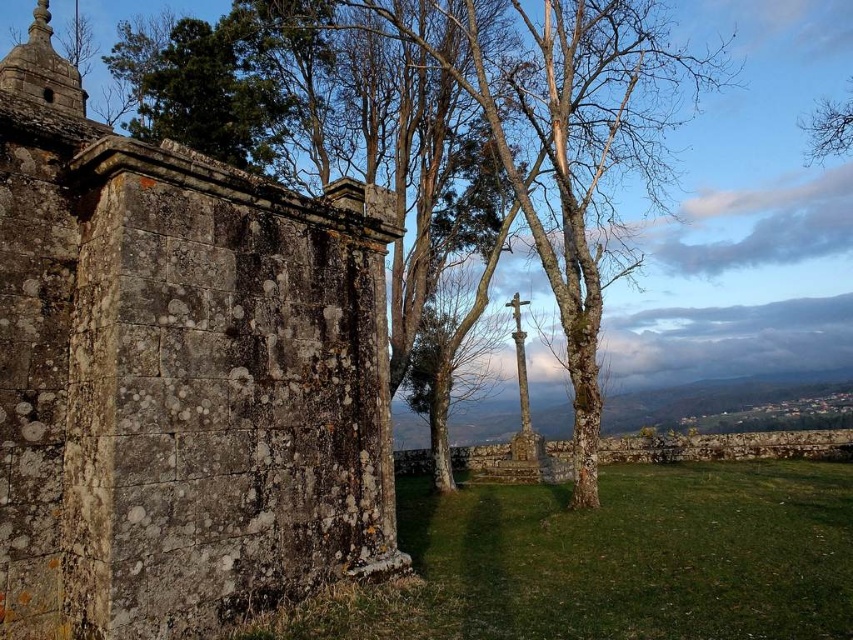
You are standing in front of the stone wall and the stone cross. You want to take a photo of the point at coordinate point (32, 144). If your camera has a maximum focus range of 6 meters, will it be able to focus on that point?

The point at coordinate point (32, 144) is 6.10 meters away from the viewer. Since the camera can only focus up to 6 meters, it will not be able to focus on that point.

You are an artist planning to sketch this scene. You want to ensure the proportions between the rusty stone wall at left and the bare wood tree at upper right are accurate. Which object should you draw first to establish the correct scale, considering their widths?

You should draw the bare wood tree at upper right first because its width is larger than the rusty stone wall at left, so establishing its scale first will help in accurately placing the smaller wall.